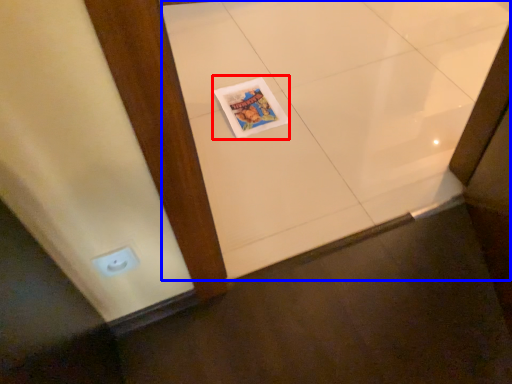
Question: Which point is further to the camera, magazine (highlighted by a red box) or ceramic tile (highlighted by a blue box)?

Choices:
 (A) magazine
 (B) ceramic tile

Answer: (A)